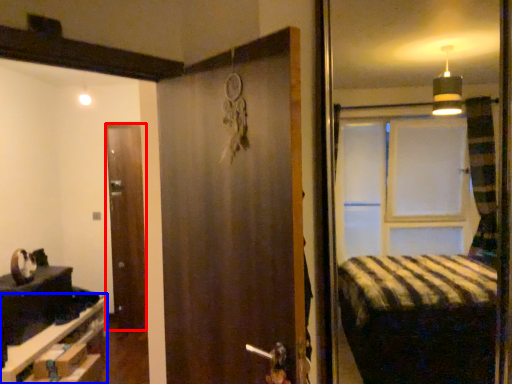
Question: Which of the following is the farthest to the observer, door (highlighted by a red box) or furniture (highlighted by a blue box)?

Choices:
 (A) door
 (B) furniture

Answer: (A)